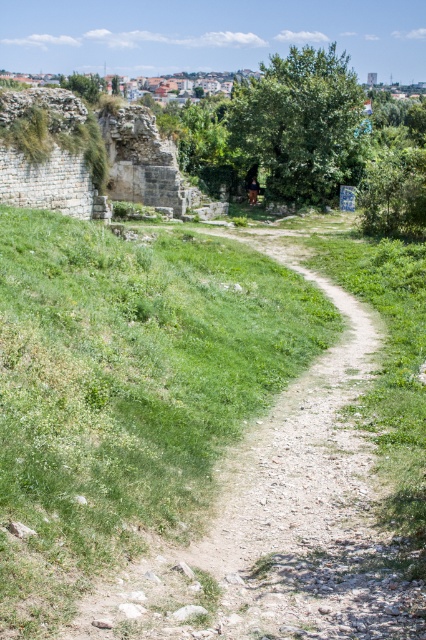
Is green grassy at center positioned behind brown leather jacket at center?

No, it is in front of brown leather jacket at center.

Consider the image. Can you confirm if green grassy at center is positioned below brown leather jacket at center?

Yes, green grassy at center is below brown leather jacket at center.

Find the location of a particular element. green grassy at center is located at coordinates (126, 388).

Where is `green grassy at center`? This screenshot has width=426, height=640. green grassy at center is located at coordinates (126, 388).